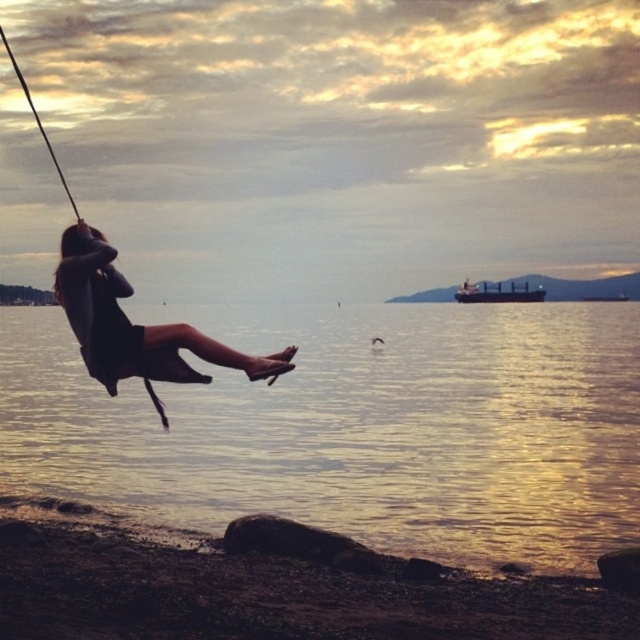
Question: Is smooth pebbles at lower left to the right of metallic gray cargo ship at right from the viewer's perspective?

Choices:
 (A) no
 (B) yes

Answer: (A)

Question: Which object is positioned closest to the smooth pebbles at lower left?

Choices:
 (A) glistening water at swing right
 (B) dark matte dress at center
 (C) metallic gray cargo ship at right

Answer: (B)

Question: Estimate the real-world distances between objects in this image. Which object is closer to the dark matte dress at center?

Choices:
 (A) metallic gray cargo ship at right
 (B) glistening water at swing right

Answer: (B)

Question: Which object is closer to the camera taking this photo?

Choices:
 (A) glistening water at swing right
 (B) metallic gray cargo ship at right
 (C) smooth pebbles at lower left

Answer: (C)

Question: Is glistening water at swing right positioned behind dark matte dress at center?

Choices:
 (A) yes
 (B) no

Answer: (A)

Question: Is smooth pebbles at lower left below dark matte dress at center?

Choices:
 (A) yes
 (B) no

Answer: (A)